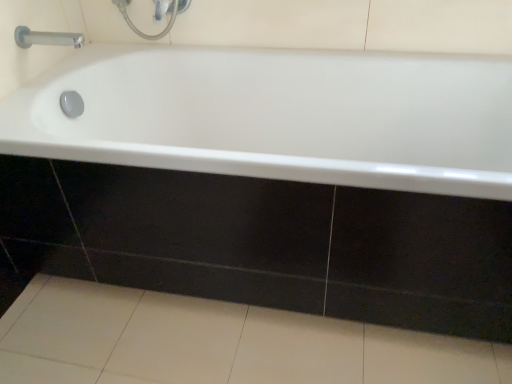
Question: Is satin chrome faucet at upper left taller or shorter than white glossy bathtub at center?

Choices:
 (A) short
 (B) tall

Answer: (A)

Question: Relative to white glossy bathtub at center, is satin chrome faucet at upper left in front or behind?

Choices:
 (A) front
 (B) behind

Answer: (B)

Question: Which of these objects is positioned farthest from the satin chrome faucet at upper left?

Choices:
 (A) white glossy bathtub at center
 (B) white glossy tile at lower center

Answer: (B)

Question: Which of these objects is positioned farthest from the satin chrome faucet at upper left?

Choices:
 (A) white glossy tile at lower center
 (B) white glossy bathtub at center

Answer: (A)